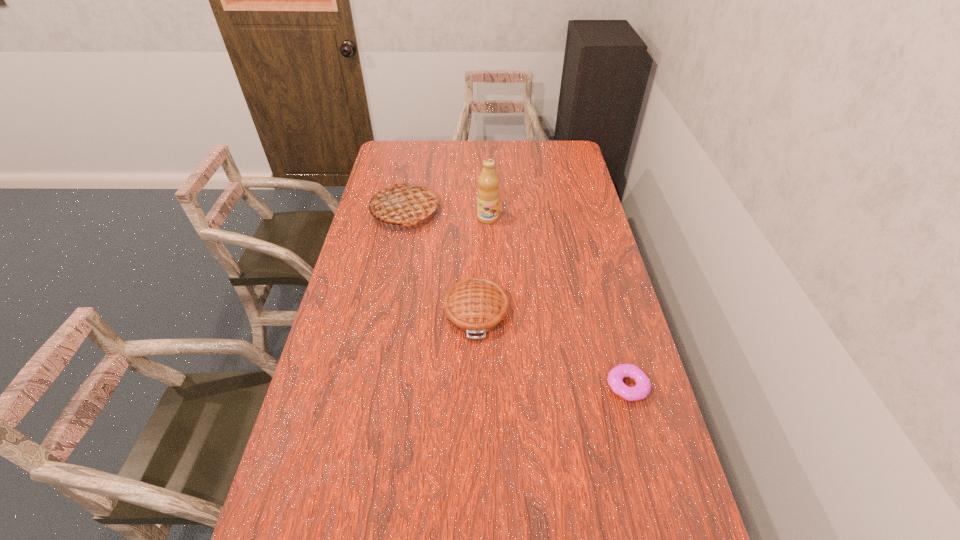
Locate an element on the screen. This screenshot has width=960, height=540. olive oil is located at coordinates (488, 193).

I want to click on the farther pie, so click(404, 203).

Identify the location of the leftmost object. This screenshot has height=540, width=960. [x=404, y=203].

Locate an element on the screen. Image resolution: width=960 pixels, height=540 pixels. the right pie is located at coordinates tap(476, 306).

This screenshot has width=960, height=540. I want to click on the second nearest object, so click(x=476, y=306).

The height and width of the screenshot is (540, 960). I want to click on the nearest object, so click(x=615, y=377).

You are a GUI agent. You are given a task and a screenshot of the screen. Output one action in this format:
    pyautogui.click(x=<x>, y=<y>)
    Task: Click on the doughnut
    Image resolution: width=960 pixels, height=540 pixels.
    Given the screenshot: What is the action you would take?
    pyautogui.click(x=615, y=377)

Identify the location of vacant region located on the label of the tallest object. (490, 273).

Where is `vacant space located on the right of the farther pie`? vacant space located on the right of the farther pie is located at coordinates (457, 212).

Image resolution: width=960 pixels, height=540 pixels. I want to click on vacant region located on the back of the right pie, so click(477, 234).